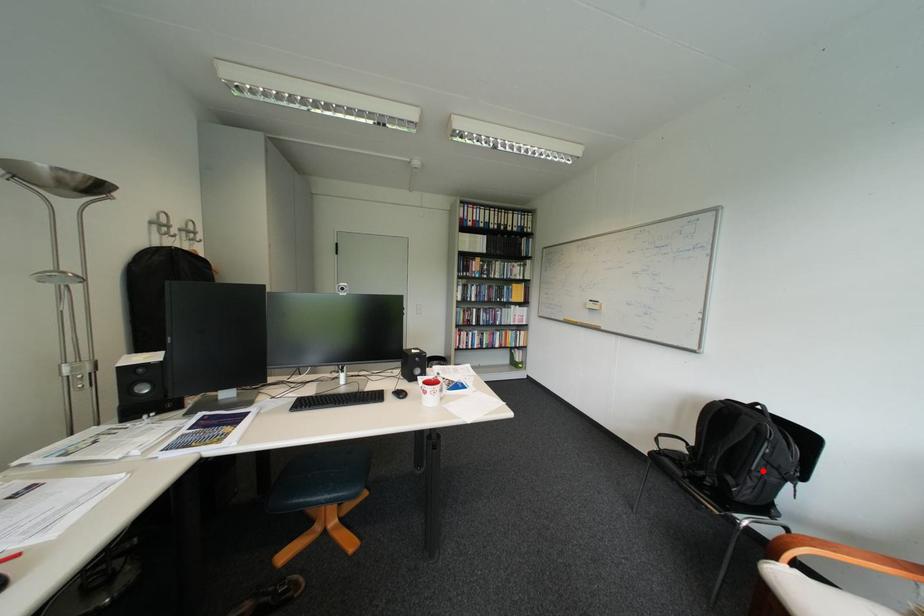
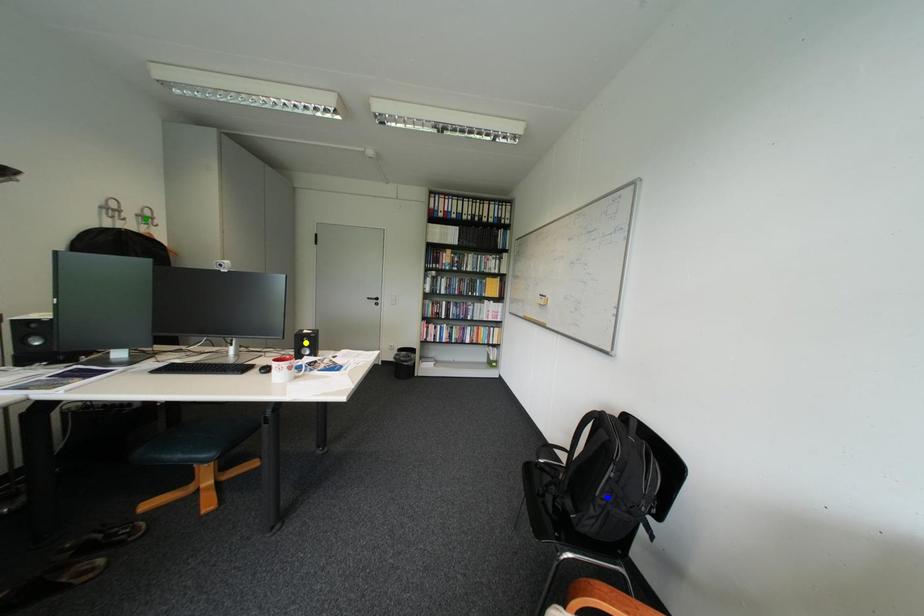
Question: I am providing you with two images of the same scene from different viewpoints. A red point is marked on the first image. You are given multiple points on the second image. Can you choose the point in image 2 that corresponds to the point in image 1?

Choices:
 (A) blue point
 (B) yellow point
 (C) green point

Answer: (A)